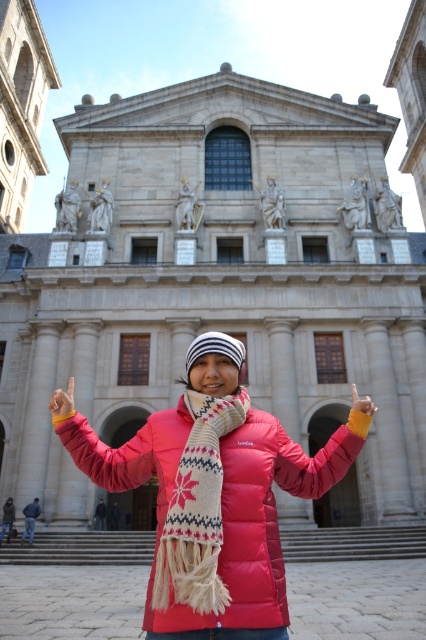
Question: Which is nearer to the matte pink down jacket at center?

Choices:
 (A) smooth yellow glove at center
 (B) matte pink jacket at center
 (C) matte pink finger at center

Answer: (B)

Question: Which of these objects is positioned farthest from the matte pink jacket at center?

Choices:
 (A) smooth yellow glove at center
 (B) matte pink down jacket at center
 (C) matte pink finger at center
 (D) white knitted scarf at center

Answer: (A)

Question: Observing the image, what is the correct spatial positioning of stone steps at center in reference to smooth yellow glove at center?

Choices:
 (A) above
 (B) below

Answer: (B)

Question: Can you confirm if matte pink down jacket at center is positioned above matte pink arm at center?

Choices:
 (A) yes
 (B) no

Answer: (B)

Question: Is matte pink arm at center below matte pink finger at center?

Choices:
 (A) yes
 (B) no

Answer: (A)

Question: Estimate the real-world distances between objects in this image. Which object is closer to the smooth yellow glove at center?

Choices:
 (A) stone steps at center
 (B) matte pink finger at center

Answer: (B)